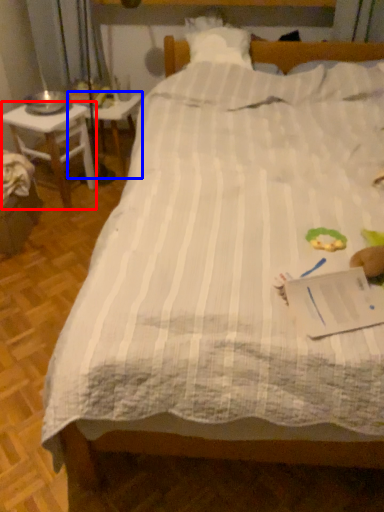
Question: Among these objects, which one is farthest to the camera, desk (highlighted by a red box) or table (highlighted by a blue box)?

Choices:
 (A) desk
 (B) table

Answer: (B)